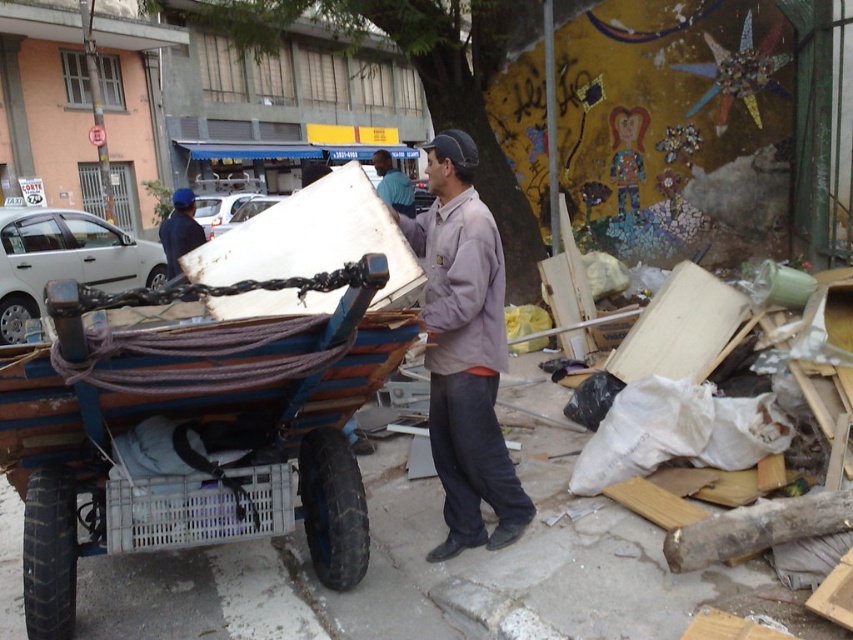
You are a passerby observing the man in the scene. Which shirt is visible on top of the man? The gray cotton shirt at center or the blue shirt at center?

The blue shirt at center is visible on top because the gray cotton shirt at center is positioned under it.

You are a delivery person who needs to locate a specific point on your uniform. The point is at coordinates point (178, 230). According to the scene, where exactly is this point located?

The point (178, 230) is located on the dark blue uniform at the left side.

You are a pedestrian standing on the sidewalk and see a blue wooden wagon at lower left and a dark blue uniform at left. Which object is closer to the right side of the image?

The blue wooden wagon at lower left is to the right of the dark blue uniform at left, so it is closer to the right side of the image.